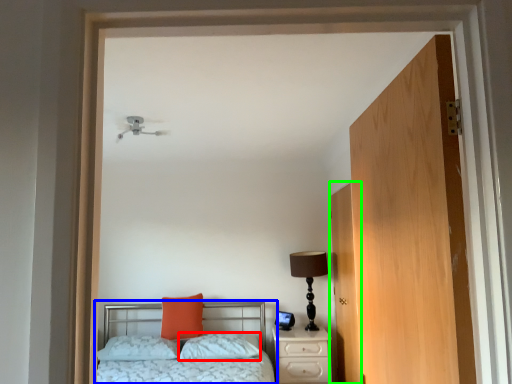
Question: Considering the real-world distances, which object is closest to pillow (highlighted by a red box)? bed (highlighted by a blue box) or door (highlighted by a green box).

Choices:
 (A) bed
 (B) door

Answer: (A)